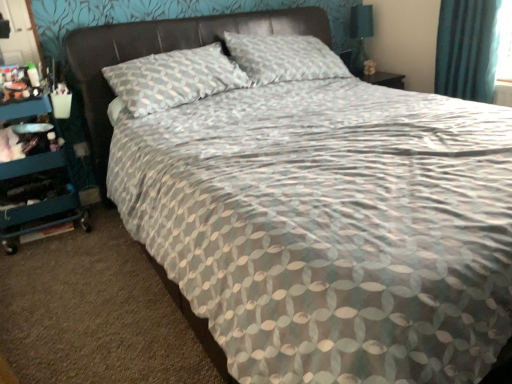
Question: Considering the relative positions of leather-like headboard at upper center and teal plastic dresser at left in the image provided, is leather-like headboard at upper center to the left of teal plastic dresser at left from the viewer's perspective?

Choices:
 (A) yes
 (B) no

Answer: (B)

Question: From the image's perspective, is leather-like headboard at upper center above teal plastic dresser at left?

Choices:
 (A) yes
 (B) no

Answer: (A)

Question: Is leather-like headboard at upper center in front of teal plastic dresser at left?

Choices:
 (A) yes
 (B) no

Answer: (A)

Question: Is leather-like headboard at upper center positioned behind teal plastic dresser at left?

Choices:
 (A) yes
 (B) no

Answer: (B)

Question: Is leather-like headboard at upper center thinner than teal plastic dresser at left?

Choices:
 (A) yes
 (B) no

Answer: (B)

Question: Could teal plastic dresser at left be considered to be inside leather-like headboard at upper center?

Choices:
 (A) yes
 (B) no

Answer: (B)

Question: Is leather-like headboard at upper center wider than matte black table lamp at upper right?

Choices:
 (A) no
 (B) yes

Answer: (B)

Question: Is leather-like headboard at upper center to the left of matte black table lamp at upper right from the viewer's perspective?

Choices:
 (A) no
 (B) yes

Answer: (B)

Question: Would you say matte black table lamp at upper right is part of leather-like headboard at upper center's contents?

Choices:
 (A) no
 (B) yes

Answer: (A)

Question: Is leather-like headboard at upper center outside of matte black table lamp at upper right?

Choices:
 (A) no
 (B) yes

Answer: (B)

Question: Can you see leather-like headboard at upper center touching matte black table lamp at upper right?

Choices:
 (A) yes
 (B) no

Answer: (B)

Question: Is leather-like headboard at upper center aimed at matte black table lamp at upper right?

Choices:
 (A) yes
 (B) no

Answer: (B)

Question: Considering the relative sizes of teal plastic dresser at left and leather-like headboard at upper center in the image provided, is teal plastic dresser at left bigger than leather-like headboard at upper center?

Choices:
 (A) no
 (B) yes

Answer: (A)